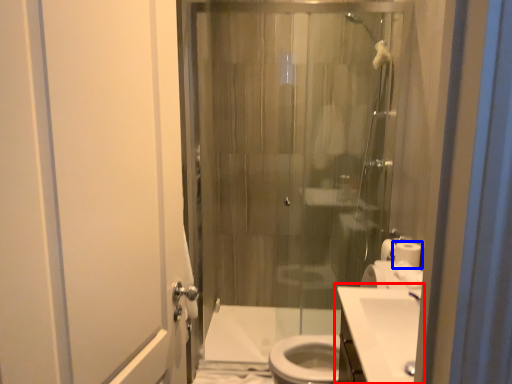
Question: Among these objects, which one is farthest to the camera, sink (highlighted by a red box) or toilet paper (highlighted by a blue box)?

Choices:
 (A) sink
 (B) toilet paper

Answer: (B)